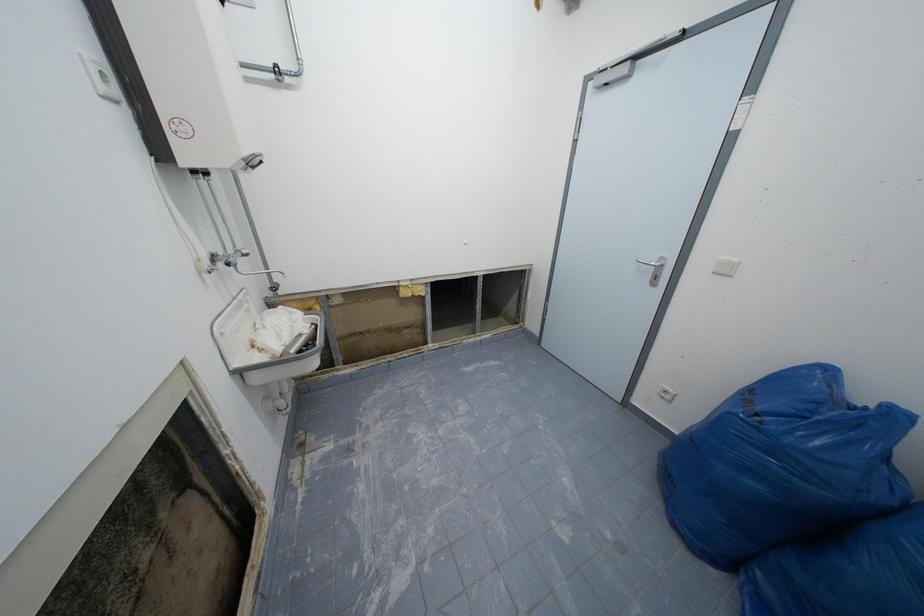
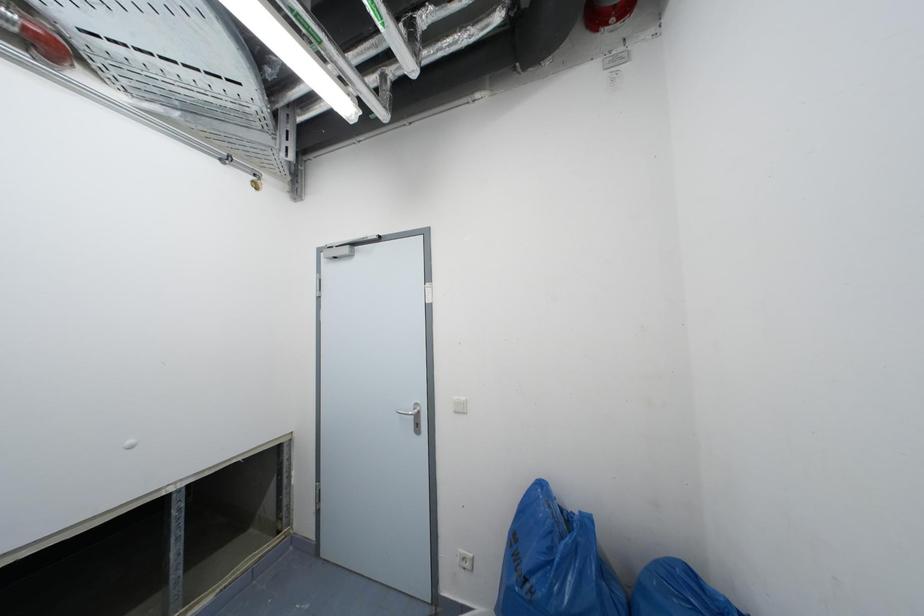
How did the camera likely rotate?

The camera rotated toward right-up.